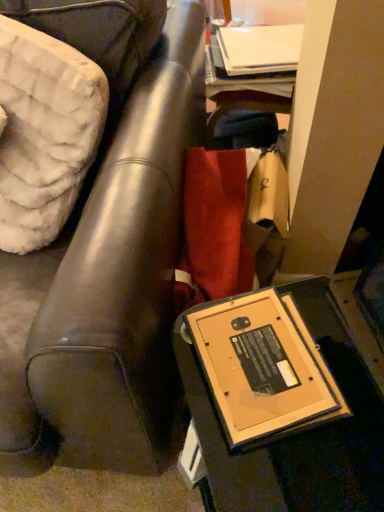
Question: Is point (16, 294) closer or farther from the camera than point (231, 329)?

Choices:
 (A) farther
 (B) closer

Answer: (A)

Question: Based on their positions, is matte black frame at lower right located to the left or right of wooden table at lower right?

Choices:
 (A) right
 (B) left

Answer: (B)

Question: Which is correct: matte black frame at lower right is inside wooden table at lower right, or outside of it?

Choices:
 (A) outside
 (B) inside

Answer: (A)

Question: From a real-world perspective, relative to matte black frame at lower right, is wooden table at lower right vertically above or below?

Choices:
 (A) above
 (B) below

Answer: (B)

Question: Choose the correct answer: Is wooden table at lower right inside matte black frame at lower right or outside it?

Choices:
 (A) inside
 (B) outside

Answer: (B)

Question: In the image, is wooden table at lower right positioned in front of or behind matte black frame at lower right?

Choices:
 (A) front
 (B) behind

Answer: (B)

Question: Considering the positions of point (342, 437) and point (105, 236), is point (342, 437) closer or farther from the camera than point (105, 236)?

Choices:
 (A) farther
 (B) closer

Answer: (A)